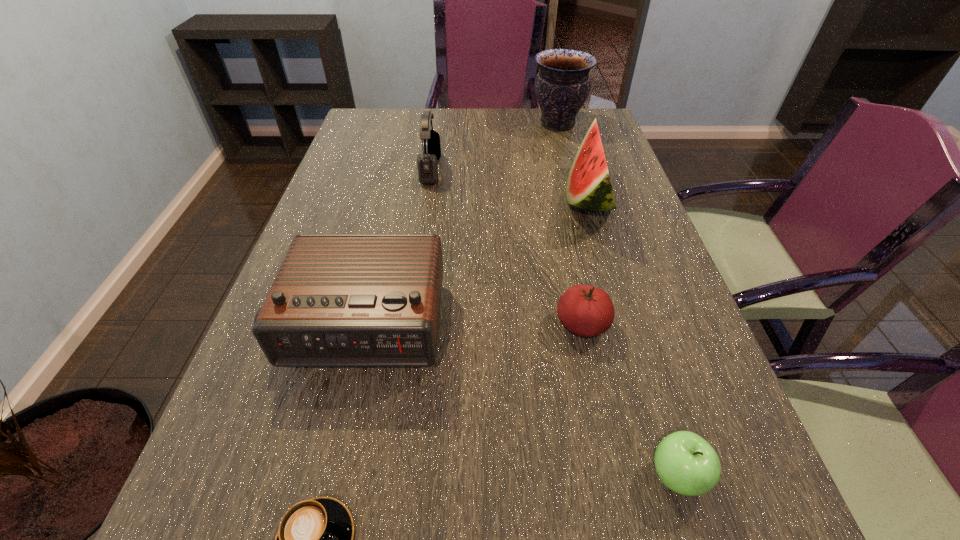
Identify the location of free location that satisfies the following two spatial constraints: 1. on the headband of the apple; 2. on the right side of the headset. The image size is (960, 540). (x=386, y=476).

Identify the location of free region that satisfies the following two spatial constraints: 1. on the front handle of the farthest object; 2. on the front side of the tomato. The width and height of the screenshot is (960, 540). (612, 325).